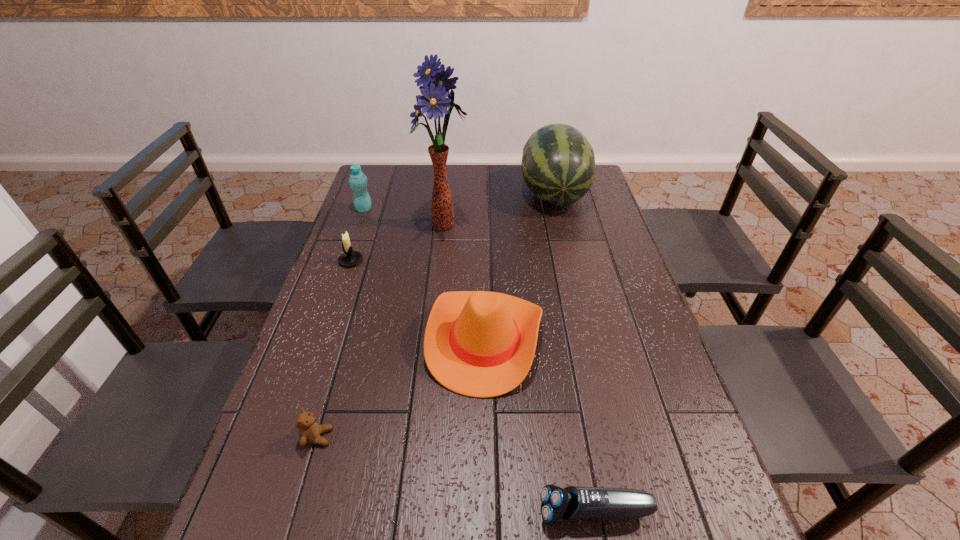
Where is `the tallest object`? The width and height of the screenshot is (960, 540). the tallest object is located at coordinates (436, 86).

You are a GUI agent. You are given a task and a screenshot of the screen. Output one action in this format:
    pyautogui.click(x=<x>, y=<y>)
    Task: Click on the second tallest object
    The width and height of the screenshot is (960, 540).
    Given the screenshot: What is the action you would take?
    pyautogui.click(x=558, y=164)

At what (x,y) coordinates should I click in order to perform the action: click on bottle. Please return your answer as a coordinate pair (x, y). Looking at the image, I should click on (358, 181).

I want to click on the fifth farthest object, so click(481, 344).

Image resolution: width=960 pixels, height=540 pixels. What are the coordinates of `the fourth nearest object` in the screenshot? It's located at (349, 258).

Find the location of `candle holder`. candle holder is located at coordinates (349, 258).

Identify the location of teddy bear. The height and width of the screenshot is (540, 960). (309, 430).

Find the location of a particular element. The image size is (960, 540). the sixth tallest object is located at coordinates (309, 430).

The image size is (960, 540). Identify the location of the nearest object. (572, 503).

The image size is (960, 540). Find the location of `electric shaver`. electric shaver is located at coordinates pos(572,503).